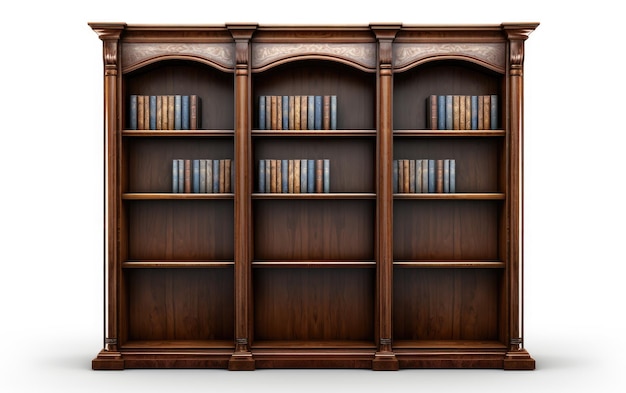
You are a GUI agent. You are given a task and a screenshot of the screen. Output one action in this format:
    pyautogui.click(x=<x>, y=<y>)
    Task: Click on the books on right side, second shelf
    
    Given the screenshot: What is the action you would take?
    pyautogui.click(x=393, y=181), pyautogui.click(x=399, y=181), pyautogui.click(x=404, y=181), pyautogui.click(x=409, y=181), pyautogui.click(x=416, y=180), pyautogui.click(x=422, y=180), pyautogui.click(x=429, y=179), pyautogui.click(x=436, y=179), pyautogui.click(x=443, y=179), pyautogui.click(x=454, y=179)